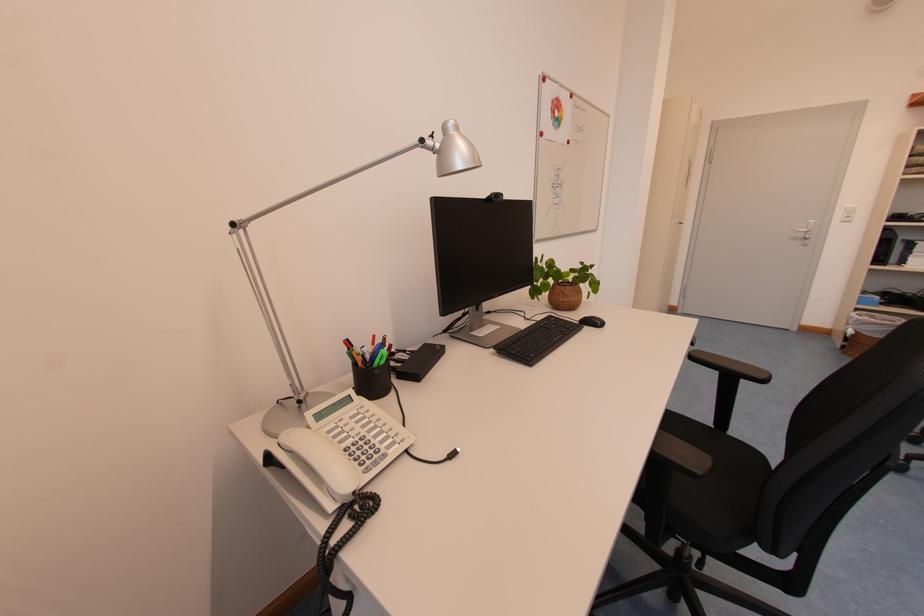
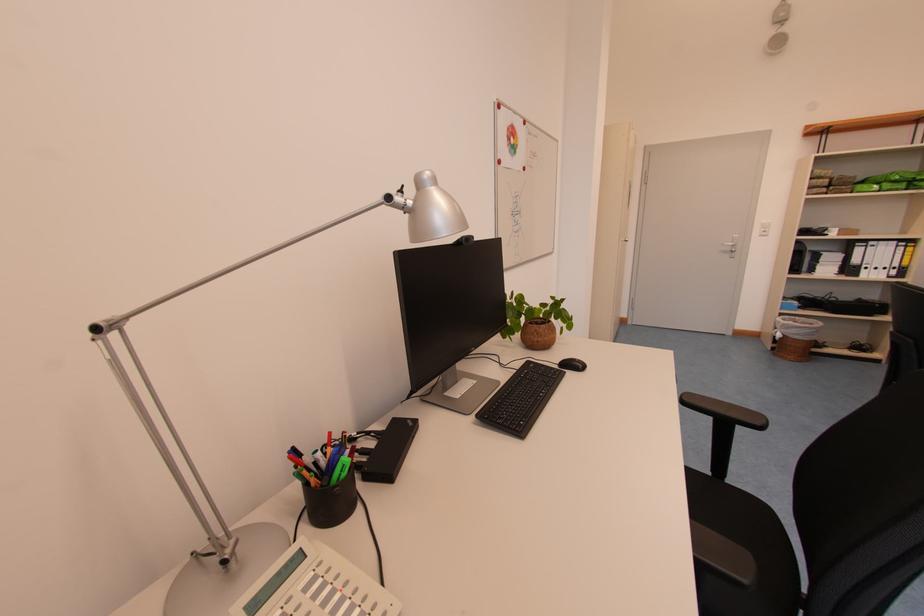
Find the pixel in the second image that matches the point at 390,365 in the first image.

(351, 477)